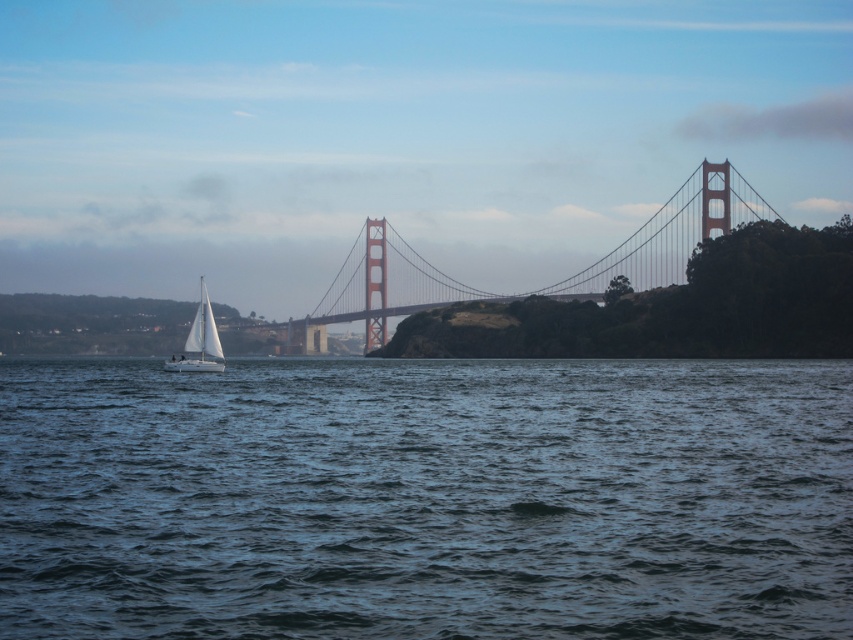
Does dark blue water at center have a greater width compared to metallic suspension bridge at center?

Yes.

Which of these two, dark blue water at center or metallic suspension bridge at center, stands taller?

With more height is metallic suspension bridge at center.

Between point (263, 504) and point (729, 172), which one is positioned behind?

Positioned behind is point (729, 172).

Identify the location of dark blue water at center. (426, 499).

Can you confirm if metallic suspension bridge at center is smaller than white matte sailboat at left?

No, metallic suspension bridge at center is not smaller than white matte sailboat at left.

Between metallic suspension bridge at center and white matte sailboat at left, which one appears on the left side from the viewer's perspective?

From the viewer's perspective, white matte sailboat at left appears more on the left side.

The width and height of the screenshot is (853, 640). I want to click on metallic suspension bridge at center, so click(535, 289).

Does dark blue water at center appear over white matte sailboat at left?

Actually, dark blue water at center is below white matte sailboat at left.

I want to click on dark blue water at center, so click(426, 499).